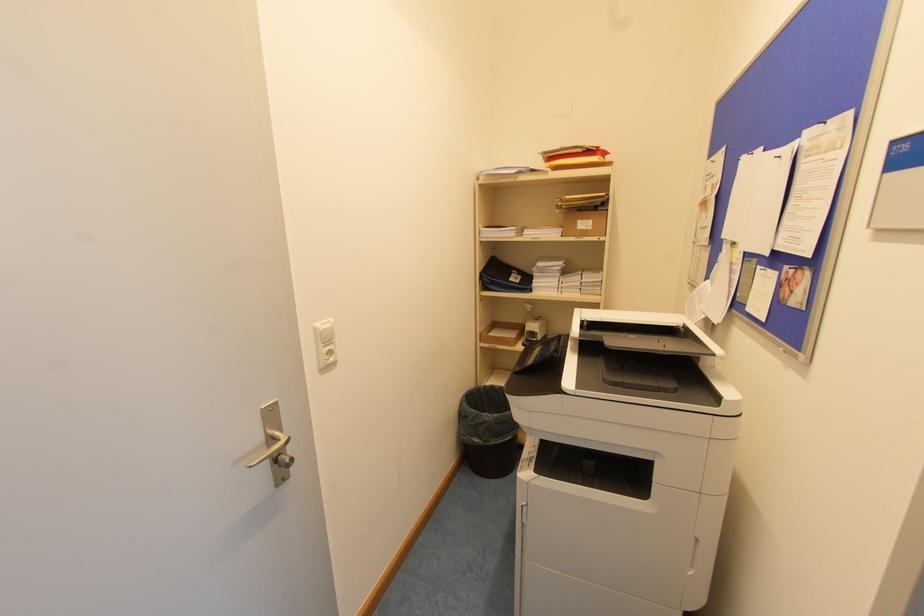
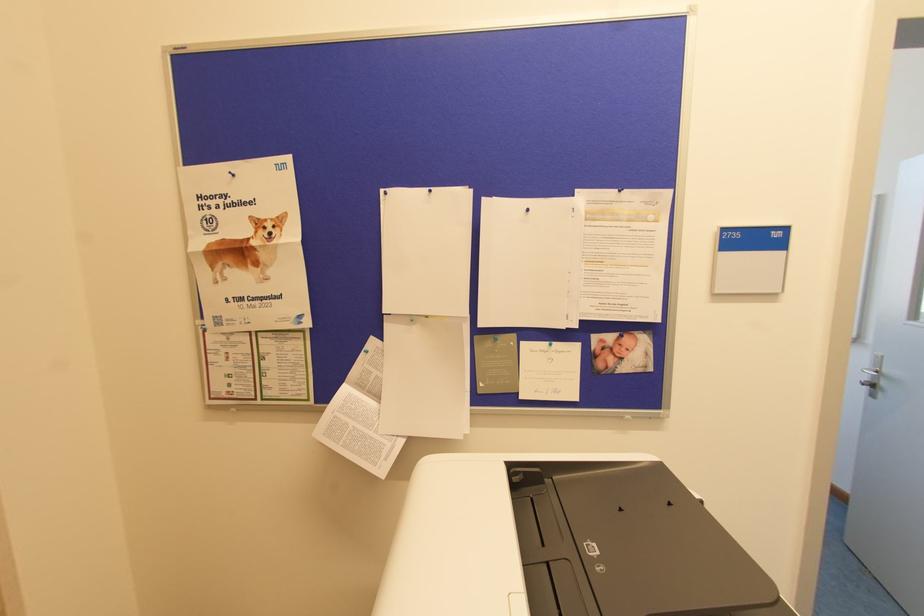
Find the pixel in the second image that matches point (825, 122) in the first image.

(619, 190)